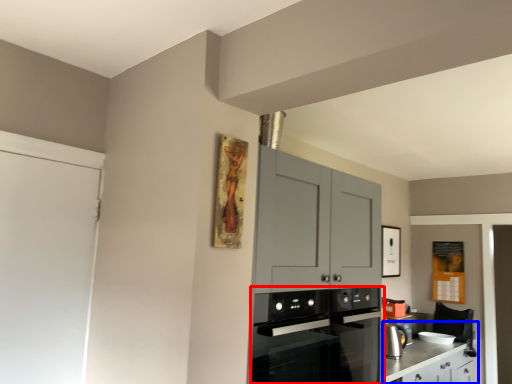
Question: Which object appears closest to the camera in this image, kitchen appliance (highlighted by a red box) or counter (highlighted by a blue box)?

Choices:
 (A) kitchen appliance
 (B) counter

Answer: (A)